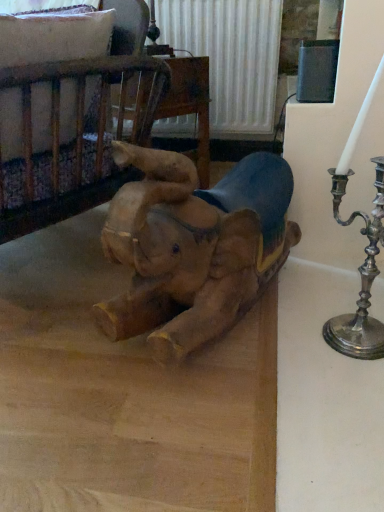
What is the approximate height of wooden elephant at center?

wooden elephant at center is 18.89 inches in height.

Locate an element on the screen. The image size is (384, 512). wooden crib at upper left is located at coordinates (62, 117).

Is wooden crib at upper left turned away from wooden elephant at center?

Yes.

From a real-world perspective, between wooden crib at upper left and wooden elephant at center, who is vertically higher?

wooden crib at upper left is physically above.

Image resolution: width=384 pixels, height=512 pixels. Find the location of `toy in front of the wooden crib at upper left`. toy in front of the wooden crib at upper left is located at coordinates (193, 246).

Based on the photo, is wooden crib at upper left to the left or to the right of wooden elephant at center in the image?

wooden crib at upper left is positioned on wooden elephant at center's left side.

Does wooden crib at upper left have a larger size compared to wooden elephant at center?

Yes, wooden crib at upper left is bigger than wooden elephant at center.

Based on the photo, how much distance is there between wooden crib at upper left and wooden elephant at center?

wooden crib at upper left and wooden elephant at center are 44.33 centimeters apart from each other.

Is the position of wooden crib at upper left less distant than that of wooden elephant at center?

No.

Could you tell me if wooden crib at upper left is turned towards wooden elephant at center?

No, wooden crib at upper left is not facing towards wooden elephant at center.

Is wooden elephant at center wider or thinner than wooden crib at upper left?

In the image, wooden elephant at center appears to be wider than wooden crib at upper left.

Looking at this image, from a real-world perspective, is wooden elephant at center above or below wooden crib at upper left?

wooden elephant at center is below wooden crib at upper left.

Does wooden elephant at center have a larger size compared to wooden crib at upper left?

Incorrect, wooden elephant at center is not larger than wooden crib at upper left.

Could you tell me if wooden elephant at center is facing wooden crib at upper left?

No, wooden elephant at center is not facing towards wooden crib at upper left.

Identify the location of cardboard in front of the wooden elephant at center. The height and width of the screenshot is (512, 384). (124, 394).

Is wooden elephant at center to the left or to the right of wooden elephant at center in the image?

In the image, wooden elephant at center appears on the left side of wooden elephant at center.

From the image's perspective, is wooden elephant at center above or below wooden elephant at center?

wooden elephant at center is situated lower than wooden elephant at center in the image.

From a real-world perspective, between wooden elephant at center and wooden elephant at center, who is vertically lower?

wooden elephant at center.

From a real-world perspective, which is physically above, wooden elephant at center or wooden crib at upper left?

From a 3D spatial view, wooden crib at upper left is above.

Is wooden elephant at center positioned with its back to wooden crib at upper left?

That's not correct — wooden elephant at center is not looking away from wooden crib at upper left.

Does wooden elephant at center come in front of wooden crib at upper left?

Yes, wooden elephant at center is in front of wooden crib at upper left.

Considering the sizes of wooden elephant at center and wooden crib at upper left in the image, is wooden elephant at center wider or thinner than wooden crib at upper left?

wooden elephant at center is thinner than wooden crib at upper left.

From a real-world perspective, is wooden elephant at center physically below wooden elephant at center?

No, from a real-world perspective, wooden elephant at center is not beneath wooden elephant at center.

From the image's perspective, between wooden elephant at center and wooden elephant at center, which one is located above?

wooden elephant at center, from the image's perspective.

Considering the relative positions of wooden elephant at center and wooden elephant at center in the image provided, is wooden elephant at center to the left of wooden elephant at center from the viewer's perspective?

→ No.

Can you tell me how much wooden elephant at center and wooden elephant at center differ in facing direction?

The angle between the facing direction of wooden elephant at center and the facing direction of wooden elephant at center is 160 degrees.

Locate an element on the screen. The height and width of the screenshot is (512, 384). furniture located above the wooden elephant at center (from the image's perspective) is located at coordinates (62, 117).

At what (x,y) coordinates should I click in order to perform the action: click on furniture behind the wooden elephant at center. Please return your answer as a coordinate pair (x, y). This screenshot has height=512, width=384. Looking at the image, I should click on pos(62,117).

Based on their spatial positions, is wooden elephant at center or wooden crib at upper left closer to wooden elephant at center?

wooden elephant at center is positioned closer to the anchor wooden elephant at center.

Which object lies further to the anchor point wooden elephant at center, wooden crib at upper left or wooden elephant at center?

Based on the image, wooden crib at upper left appears to be further to wooden elephant at center.

Estimate the real-world distances between objects in this image. Which object is closer to wooden elephant at center, wooden elephant at center or wooden crib at upper left?

The object closer to wooden elephant at center is wooden elephant at center.

From the image, which object appears to be farther from wooden elephant at center, wooden crib at upper left or wooden elephant at center?

The object further to wooden elephant at center is wooden crib at upper left.

From the picture: From the image, which object appears to be nearer to wooden crib at upper left, wooden elephant at center or wooden elephant at center?

wooden elephant at center lies closer to wooden crib at upper left than the other object.

Considering their positions, is wooden elephant at center positioned closer to wooden crib at upper left than wooden elephant at center?

Based on the image, wooden elephant at center appears to be nearer to wooden crib at upper left.

Identify the location of toy that lies between wooden crib at upper left and wooden elephant at center from top to bottom. (193, 246).